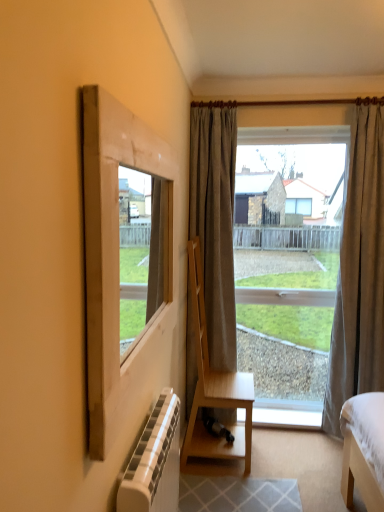
Question: Does white textured radiator at lower left have a lesser width compared to matte gray curtain at right, the first curtain positioned from the right?

Choices:
 (A) yes
 (B) no

Answer: (A)

Question: Is the depth of white textured radiator at lower left greater than that of matte gray curtain at right, the first curtain positioned from the right?

Choices:
 (A) yes
 (B) no

Answer: (B)

Question: Considering the relative sizes of white textured radiator at lower left and matte gray curtain at right, positioned as the 2th curtain in left-to-right order, in the image provided, is white textured radiator at lower left smaller than matte gray curtain at right, positioned as the 2th curtain in left-to-right order,?

Choices:
 (A) no
 (B) yes

Answer: (B)

Question: Considering the relative sizes of white textured radiator at lower left and matte gray curtain at right, positioned as the 2th curtain in left-to-right order, in the image provided, is white textured radiator at lower left taller than matte gray curtain at right, positioned as the 2th curtain in left-to-right order,?

Choices:
 (A) yes
 (B) no

Answer: (B)

Question: Is white textured radiator at lower left wider than matte gray curtain at right, the first curtain positioned from the right?

Choices:
 (A) no
 (B) yes

Answer: (A)

Question: Is white textured radiator at lower left inside or outside of clear glass window at center?

Choices:
 (A) inside
 (B) outside

Answer: (B)

Question: Would you say white textured radiator at lower left is to the left or to the right of clear glass window at center in the picture?

Choices:
 (A) right
 (B) left

Answer: (B)

Question: From the image's perspective, is white textured radiator at lower left above or below clear glass window at center?

Choices:
 (A) above
 (B) below

Answer: (B)

Question: Is white textured radiator at lower left in front of or behind clear glass window at center in the image?

Choices:
 (A) behind
 (B) front

Answer: (B)

Question: Based on their sizes in the image, would you say white painted wood at lower center is bigger or smaller than natural wood frame at left?

Choices:
 (A) big
 (B) small

Answer: (B)

Question: From their relative heights in the image, would you say white painted wood at lower center is taller or shorter than natural wood frame at left?

Choices:
 (A) tall
 (B) short

Answer: (B)

Question: Is point (279, 420) positioned closer to the camera than point (132, 147)?

Choices:
 (A) farther
 (B) closer

Answer: (A)

Question: From the image's perspective, is white painted wood at lower center positioned above or below natural wood frame at left?

Choices:
 (A) below
 (B) above

Answer: (A)

Question: Is clear glass window at center spatially inside matte gray curtain at right, positioned as the 2th curtain in left-to-right order, or outside of it?

Choices:
 (A) inside
 (B) outside

Answer: (B)

Question: Relative to matte gray curtain at right, positioned as the 2th curtain in left-to-right order, is clear glass window at center in front or behind?

Choices:
 (A) behind
 (B) front

Answer: (A)